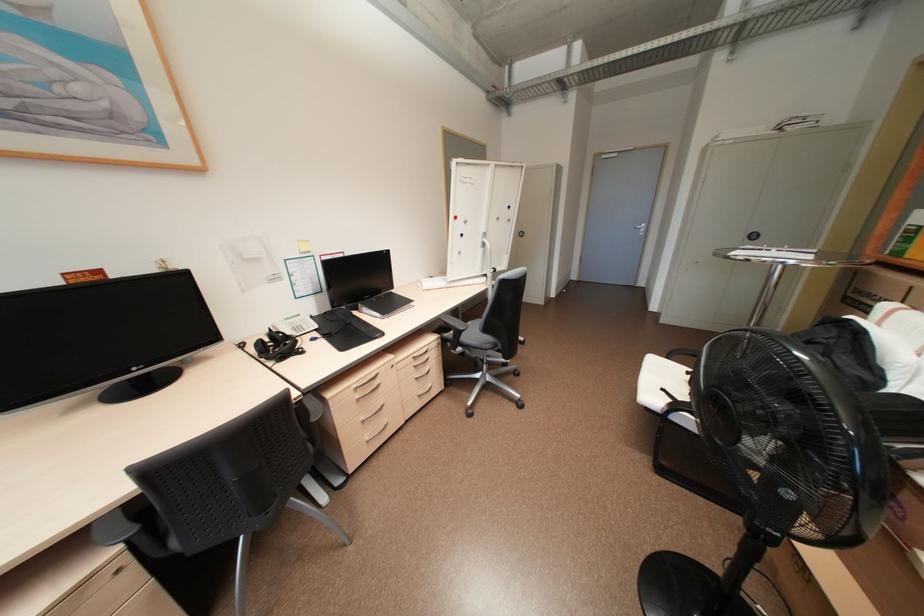
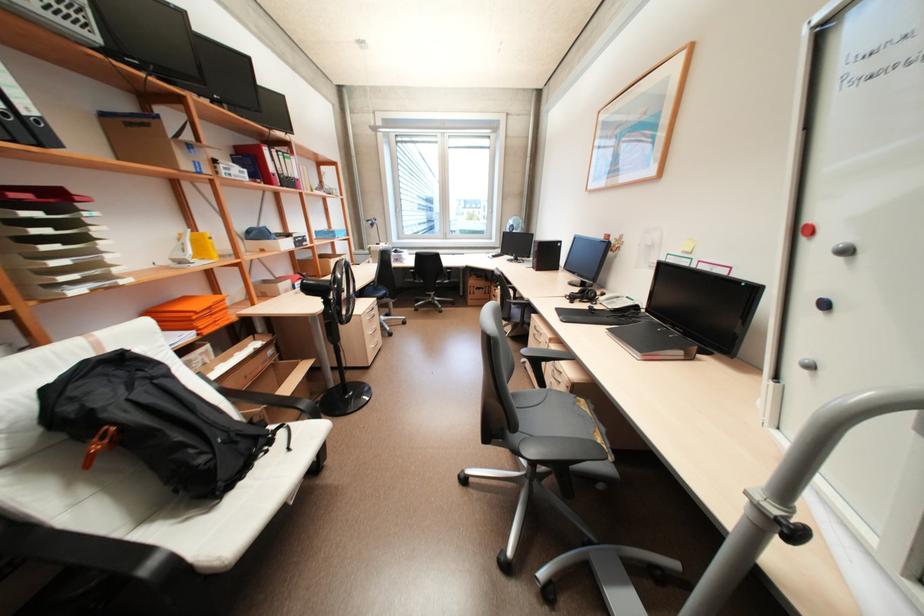
Find the pixel in the second image that matches point 468,235 in the first image.

(830, 304)